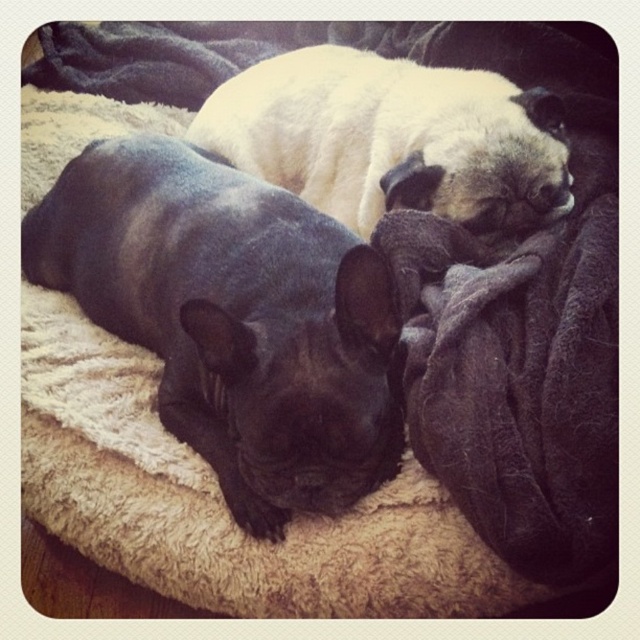
You are a dog owner who wants to place a small water bowl between the black smooth french bulldog at left and the white fur dog at upper center. The bowl has a diameter of 10 inches. Will there be enough space between them to fit the bowl?

The black smooth french bulldog at left and white fur dog at upper center are 12.83 inches apart from each other. Since the bowl requires 10 inches of space, there is enough room to place it between them.